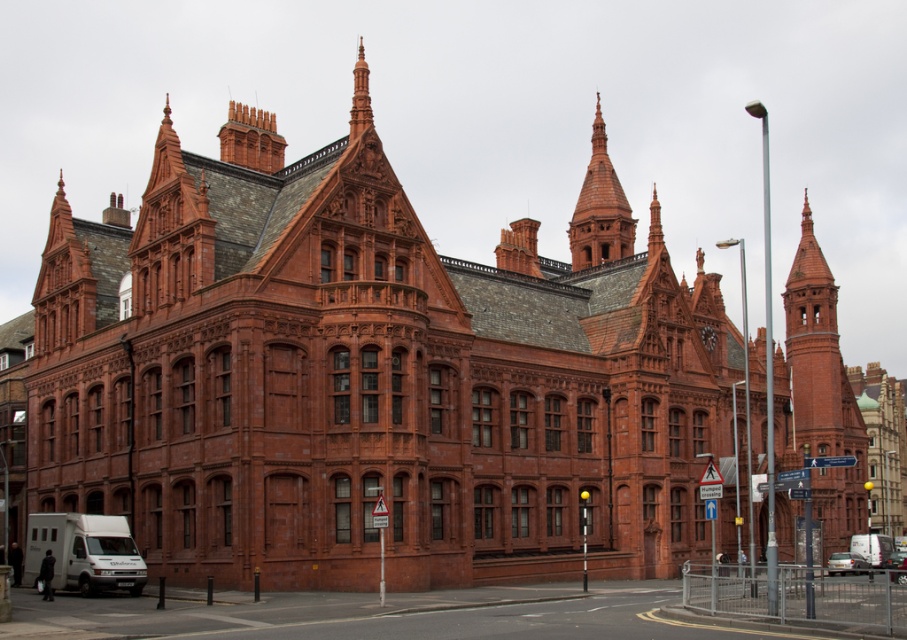
Who is positioned more to the right, smooth terracotta tower at upper center or metallic silver car at center?

From the viewer's perspective, metallic silver car at center appears more on the right side.

Is smooth terracotta tower at upper center shorter than metallic silver car at center?

Incorrect, smooth terracotta tower at upper center's height does not fall short of metallic silver car at center's.

Does point (588, 205) lie in front of point (902, 554)?

No, it is behind (902, 554).

Identify the location of smooth terracotta tower at upper center. (600, 209).

Can you confirm if smooth terracotta tower at upper center is thinner than silver metallic car at lower right?

Correct, smooth terracotta tower at upper center's width is less than silver metallic car at lower right's.

Is smooth terracotta tower at upper center positioned before silver metallic car at lower right?

No, smooth terracotta tower at upper center is further to the viewer.

Between point (589, 259) and point (850, 572), which one is positioned in front?

Positioned in front is point (850, 572).

This screenshot has height=640, width=907. What are the coordinates of `smooth terracotta tower at upper center` in the screenshot? It's located at (600, 209).

Can you confirm if red brick tower at upper right is positioned to the left of silver metallic car at lower right?

No, red brick tower at upper right is not to the left of silver metallic car at lower right.

Does point (803, 307) lie behind point (847, 563)?

That is True.

Looking at this image, who is more forward, (x=845, y=400) or (x=834, y=573)?

Point (x=834, y=573) is in front.

Locate an element on the screen. The width and height of the screenshot is (907, 640). red brick tower at upper right is located at coordinates (822, 392).